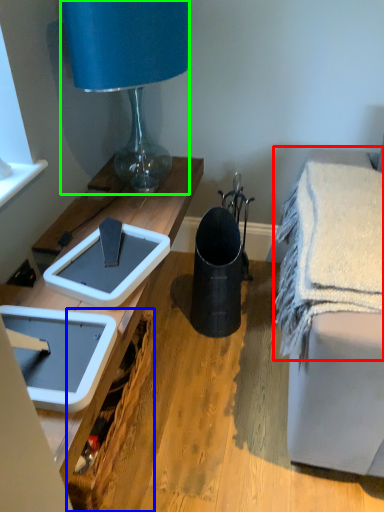
Question: Estimate the real-world distances between objects in this image. Which object is farther from bath towel (highlighted by a red box), picnic basket (highlighted by a blue box) or lamp (highlighted by a green box)?

Choices:
 (A) picnic basket
 (B) lamp

Answer: (B)